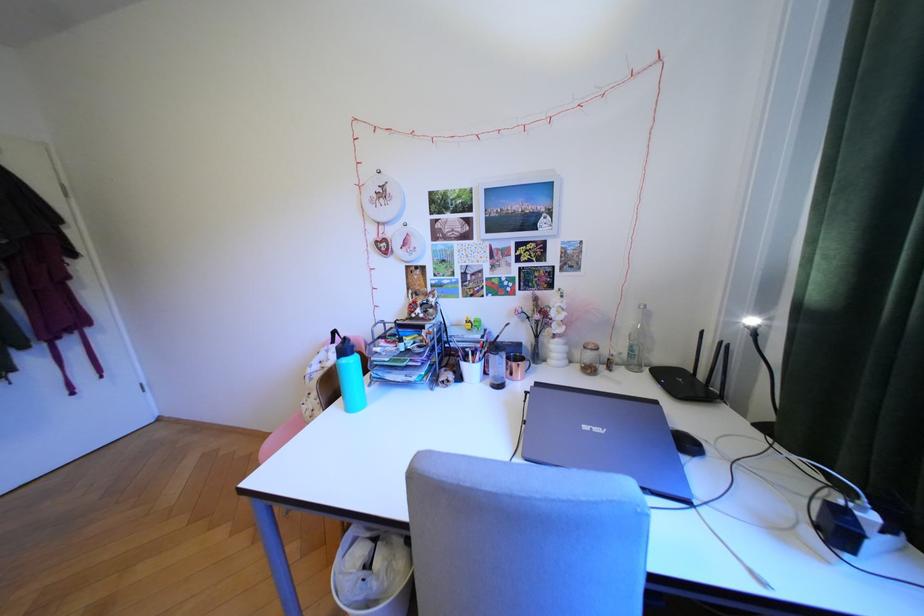
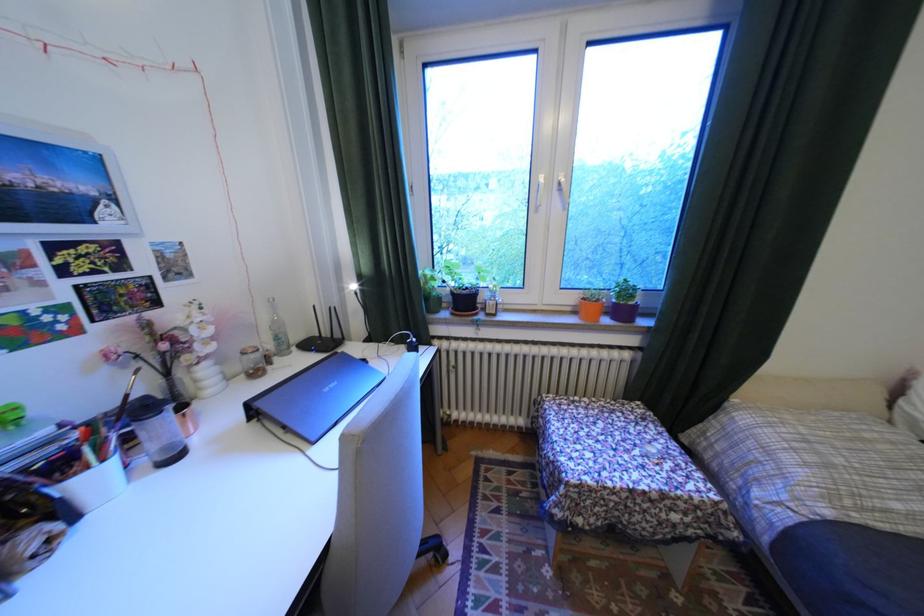
Where in the second image is the point corresponding to point 598,347 from the first image?

(254, 354)